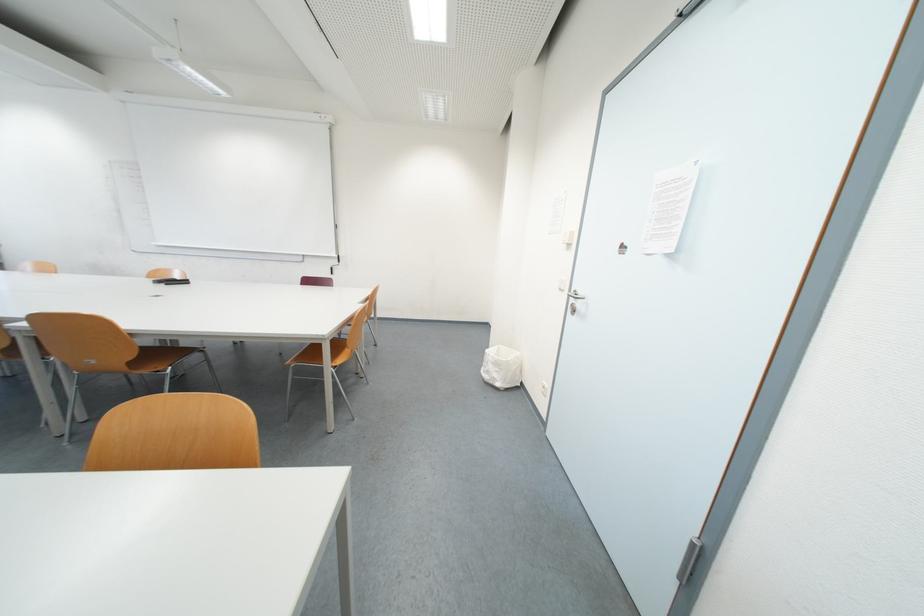
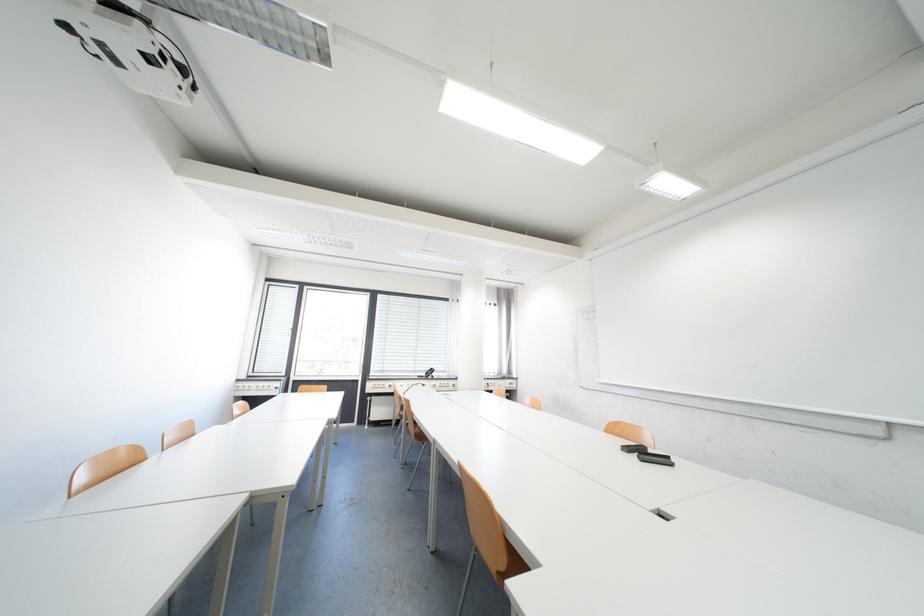
Where in the second image is the point corresponding to [180,283] from the first image?

(652, 454)